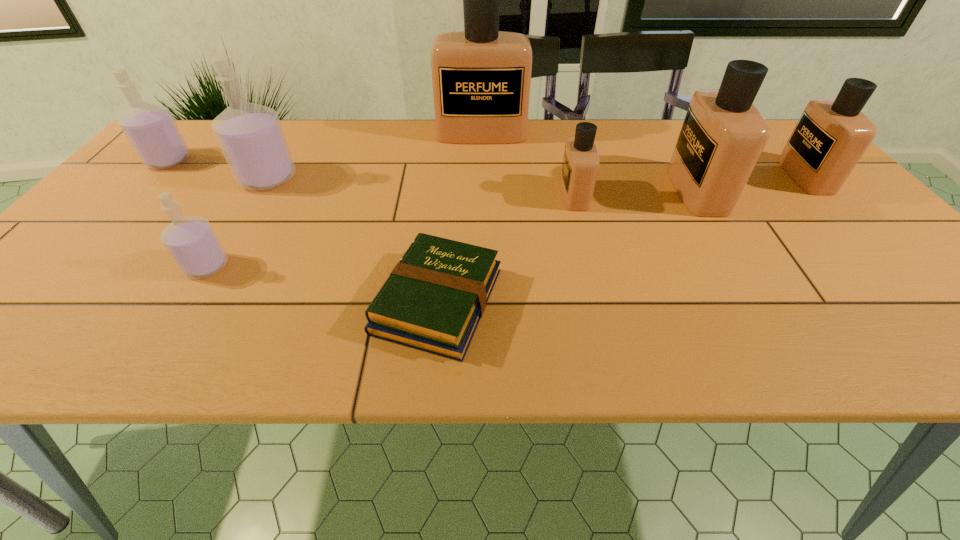
What are the coordinates of `the fourth perfume from left to right` in the screenshot? It's located at (481, 77).

Locate an element on the screen. The image size is (960, 540). the farthest perfume is located at coordinates (481, 77).

Find the location of a particular element. The image size is (960, 540). the sixth perfume from left to right is located at coordinates (723, 134).

Where is `the seventh object from left to right`? The height and width of the screenshot is (540, 960). the seventh object from left to right is located at coordinates (723, 134).

In order to click on the biggest purple perfume in this screenshot , I will do `click(251, 137)`.

You are a GUI agent. You are given a task and a screenshot of the screen. Output one action in this format:
    pyautogui.click(x=<x>, y=<y>)
    Task: Click on the leftmost perfume
    
    Given the screenshot: What is the action you would take?
    pyautogui.click(x=150, y=129)

Locate an element on the screen. Image resolution: width=960 pixels, height=540 pixels. the second smallest purple perfume is located at coordinates (150, 129).

Identify the location of the rightmost beige perfume. This screenshot has height=540, width=960. (831, 136).

In order to click on the rightmost perfume in this screenshot , I will do `click(831, 136)`.

In order to click on the fifth perfume from left to right in this screenshot , I will do `click(580, 166)`.